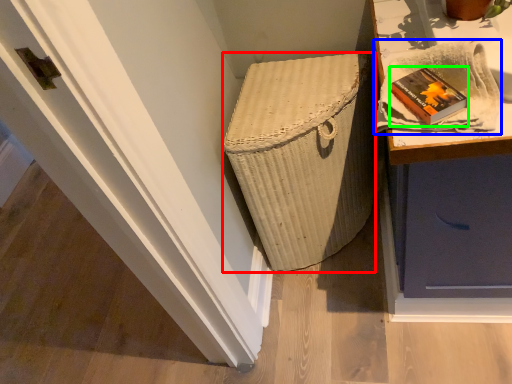
Question: Based on their relative distances, which object is farther from basket container (highlighted by a red box)? Choose from cloth (highlighted by a blue box) and book (highlighted by a green box).

Choices:
 (A) cloth
 (B) book

Answer: (B)